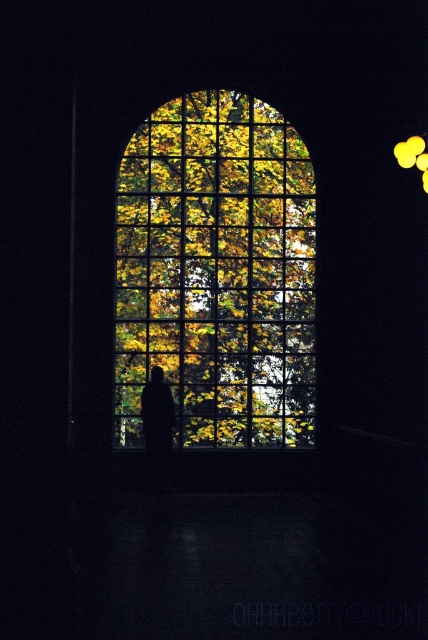
Question: Which of the following is the closest to the observer?

Choices:
 (A) (403, 156)
 (B) (169, 432)

Answer: (A)

Question: Is translucent glass window at center to the right of black matte figure at center from the viewer's perspective?

Choices:
 (A) yes
 (B) no

Answer: (A)

Question: Does translucent glass window at center appear on the right side of yellow matte light at upper right?

Choices:
 (A) no
 (B) yes

Answer: (A)

Question: Based on their relative distances, which object is farther from the yellow matte light at upper right?

Choices:
 (A) translucent glass window at center
 (B) black matte figure at center

Answer: (B)

Question: Estimate the real-world distances between objects in this image. Which object is farther from the translucent glass window at center?

Choices:
 (A) yellow matte light at upper right
 (B) black matte figure at center

Answer: (A)

Question: Is the position of translucent glass window at center less distant than that of yellow matte light at upper right?

Choices:
 (A) no
 (B) yes

Answer: (A)